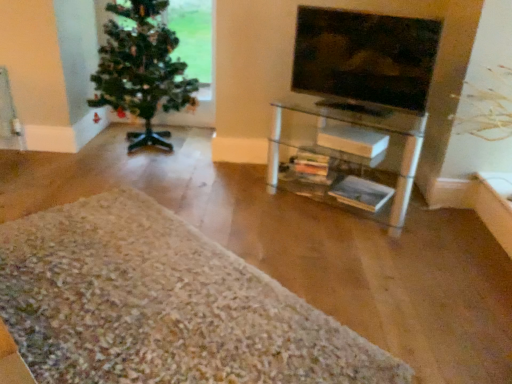
Question: From their relative heights in the image, would you say white shaggy rug at lower left is taller or shorter than green matte christmas tree at left?

Choices:
 (A) short
 (B) tall

Answer: (A)

Question: Is white shaggy rug at lower left in front of or behind green matte christmas tree at left in the image?

Choices:
 (A) front
 (B) behind

Answer: (A)

Question: Considering the real-world distances, which object is closest to the white shaggy rug at lower left?

Choices:
 (A) clear glass shelf at center
 (B) green matte christmas tree at left
 (C) matte glass tv at upper right

Answer: (A)

Question: Based on their relative distances, which object is farther from the clear glass shelf at center?

Choices:
 (A) green matte christmas tree at left
 (B) white shaggy rug at lower left
 (C) matte glass tv at upper right

Answer: (B)